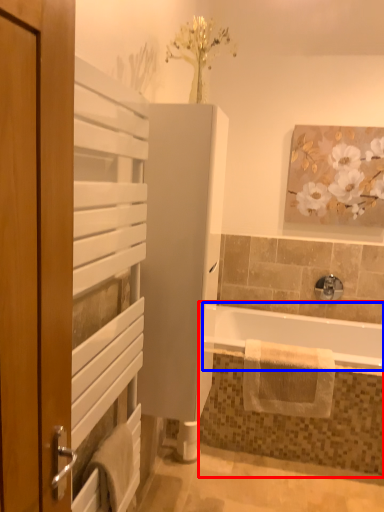
Question: Which of the following is the farthest to the observer, jacuzzi (highlighted by a red box) or bathtub (highlighted by a blue box)?

Choices:
 (A) jacuzzi
 (B) bathtub

Answer: (A)